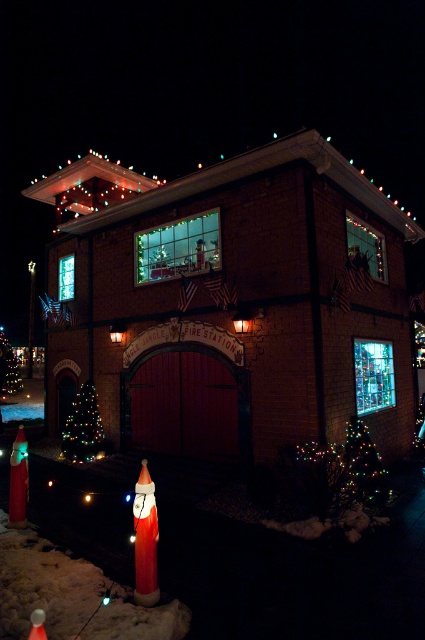
Question: Is smooth wooden garage door at center bigger than multicolored lights at lower right?

Choices:
 (A) yes
 (B) no

Answer: (A)

Question: Where is smooth wooden garage door at center located in relation to green matte christmas tree at lower left in the image?

Choices:
 (A) left
 (B) right

Answer: (B)

Question: Among these objects, which one is farthest from the camera?

Choices:
 (A) smooth wooden garage door at center
 (B) green matte christmas tree at lower left
 (C) multicolored lights at lower right

Answer: (B)

Question: Is smooth wooden garage door at center below green matte christmas tree at lower left?

Choices:
 (A) yes
 (B) no

Answer: (B)

Question: Which of these objects is positioned closest to the smooth wooden garage door at center?

Choices:
 (A) green matte christmas tree at lower left
 (B) multicolored lights at lower right

Answer: (A)

Question: Estimate the real-world distances between objects in this image. Which object is farther from the multicolored lights at lower right?

Choices:
 (A) green matte christmas tree at lower left
 (B) smooth wooden garage door at center

Answer: (A)